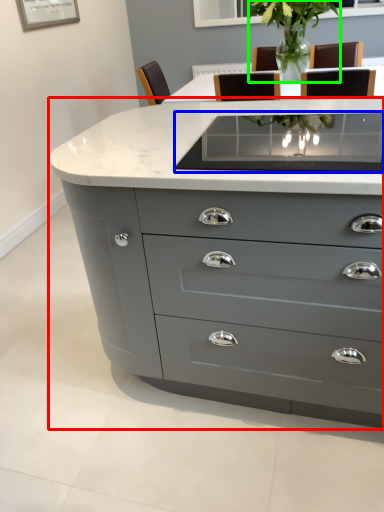
Question: Which is farther away from chest of drawers (highlighted by a red box)? glass table (highlighted by a blue box) or plant (highlighted by a green box)?

Choices:
 (A) glass table
 (B) plant

Answer: (B)